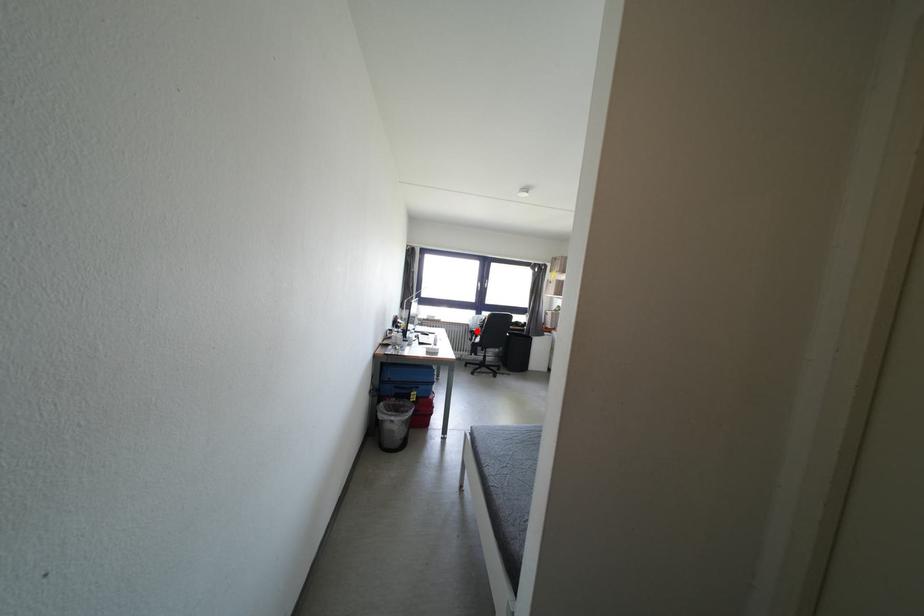
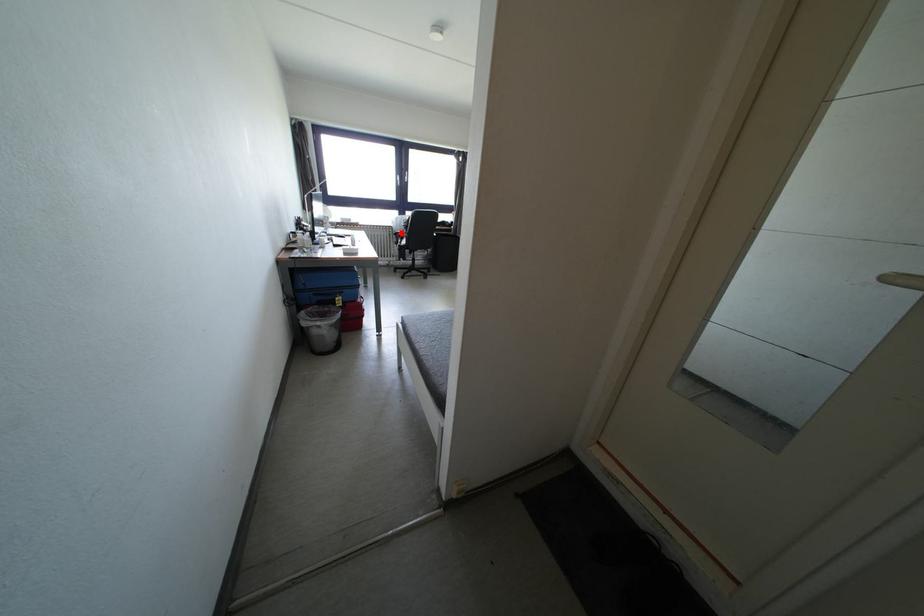
I am providing you with two images of the same scene from different viewpoints. A red point is marked on the first image and another point is marked on the second image. Do the highlighted points in image1 and image2 indicate the same real-world spot?

Yes